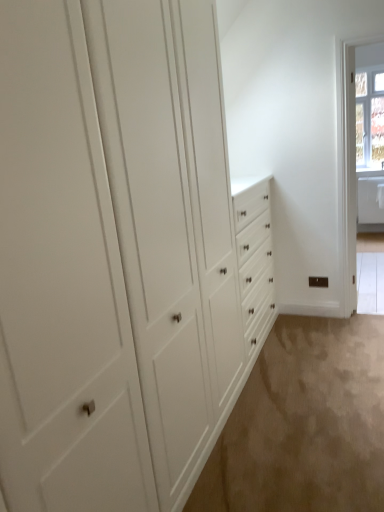
What do you see at coordinates (304, 423) in the screenshot? I see `beige carpet at lower right` at bounding box center [304, 423].

Image resolution: width=384 pixels, height=512 pixels. I want to click on beige carpet at lower right, so click(304, 423).

Describe the element at coordinates (369, 116) in the screenshot. I see `clear glass window at upper right` at that location.

Where is `clear glass window at upper right`? The image size is (384, 512). clear glass window at upper right is located at coordinates (369, 116).

I want to click on beige carpet at lower right, so coord(304,423).

Consider the image. Does beige carpet at lower right appear on the left side of clear glass window at upper right?

Yes, beige carpet at lower right is to the left of clear glass window at upper right.

Does beige carpet at lower right come behind clear glass window at upper right?

No, it is not.

Is point (305, 362) in front of point (363, 129)?

Yes.

From the image's perspective, is beige carpet at lower right on top of clear glass window at upper right?

No.

From a real-world perspective, between beige carpet at lower right and clear glass window at upper right, who is vertically higher?

clear glass window at upper right.

Considering the relative sizes of beige carpet at lower right and clear glass window at upper right in the image provided, is beige carpet at lower right thinner than clear glass window at upper right?

Incorrect, the width of beige carpet at lower right is not less than that of clear glass window at upper right.

Is beige carpet at lower right taller or shorter than clear glass window at upper right?

Considering their sizes, beige carpet at lower right has less height than clear glass window at upper right.

Does beige carpet at lower right have a larger size compared to clear glass window at upper right?

Yes, beige carpet at lower right is bigger than clear glass window at upper right.

Would you say beige carpet at lower right is inside or outside clear glass window at upper right?

beige carpet at lower right is not inside clear glass window at upper right, it's outside.

Consider the image. Is beige carpet at lower right touching clear glass window at upper right?

There is a gap between beige carpet at lower right and clear glass window at upper right.

Is beige carpet at lower right turned away from clear glass window at upper right?

beige carpet at lower right is not turned away from clear glass window at upper right.

Measure the distance from beige carpet at lower right to clear glass window at upper right.

A distance of 1.79 meters exists between beige carpet at lower right and clear glass window at upper right.

The width and height of the screenshot is (384, 512). I want to click on plain below the clear glass window at upper right (from a real-world perspective), so click(x=304, y=423).

Considering the relative positions of clear glass window at upper right and beige carpet at lower right in the image provided, is clear glass window at upper right to the right of beige carpet at lower right from the viewer's perspective?

Indeed, clear glass window at upper right is positioned on the right side of beige carpet at lower right.

Does clear glass window at upper right come in front of beige carpet at lower right?

No, clear glass window at upper right is behind beige carpet at lower right.

Does point (364, 89) appear closer or farther from the camera than point (270, 490)?

Point (364, 89) is farther from the camera than point (270, 490).

From the image's perspective, would you say clear glass window at upper right is shown under beige carpet at lower right?

No, from the image's perspective, clear glass window at upper right is not below beige carpet at lower right.

From a real-world perspective, is clear glass window at upper right physically located above or below beige carpet at lower right?

Clearly, from a real-world perspective, clear glass window at upper right is above beige carpet at lower right.

From the picture: Can you confirm if clear glass window at upper right is wider than beige carpet at lower right?

Incorrect, the width of clear glass window at upper right does not surpass that of beige carpet at lower right.

Which of these two, clear glass window at upper right or beige carpet at lower right, stands shorter?

beige carpet at lower right.

Considering the sizes of objects clear glass window at upper right and beige carpet at lower right in the image provided, who is bigger, clear glass window at upper right or beige carpet at lower right?

Bigger between the two is beige carpet at lower right.

Which is correct: clear glass window at upper right is inside beige carpet at lower right, or outside of it?

The correct answer is: outside.

Is there a large distance between clear glass window at upper right and beige carpet at lower right?

Yes.

In the scene shown: Does clear glass window at upper right turn towards beige carpet at lower right?

Yes, clear glass window at upper right faces towards beige carpet at lower right.

How different are the orientations of clear glass window at upper right and beige carpet at lower right in degrees?

There is a 90.8-degree angle between the facing directions of clear glass window at upper right and beige carpet at lower right.

I want to click on plain below the clear glass window at upper right (from a real-world perspective), so [x=304, y=423].

This screenshot has height=512, width=384. In order to click on window on the right of beige carpet at lower right in this screenshot , I will do `click(369, 116)`.

Identify the location of window that is above the beige carpet at lower right (from the image's perspective). (369, 116).